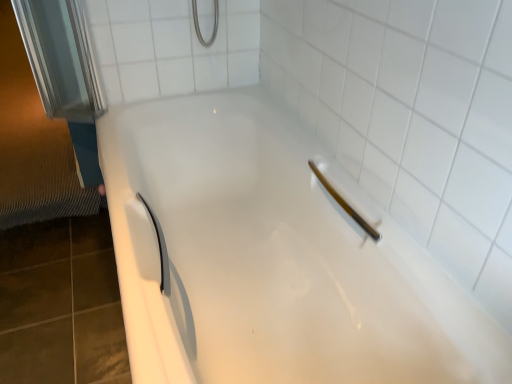
This screenshot has width=512, height=384. What do you see at coordinates (170, 47) in the screenshot?
I see `white ceramic tile at upper center` at bounding box center [170, 47].

Image resolution: width=512 pixels, height=384 pixels. I want to click on matte white shower at upper right, so click(345, 204).

The width and height of the screenshot is (512, 384). Find the location of `white ceramic tile at upper center`. white ceramic tile at upper center is located at coordinates (170, 47).

Who is taller, white ceramic tile at upper center or white glossy bathtub at center?

With more height is white ceramic tile at upper center.

Are white ceramic tile at upper center and white glossy bathtub at center far apart?

That's not correct — white ceramic tile at upper center is a little close to white glossy bathtub at center.

From a real-world perspective, is white ceramic tile at upper center above or below white glossy bathtub at center?

In terms of real-world spatial position, white ceramic tile at upper center is above white glossy bathtub at center.

Is white ceramic tile at upper center positioned with its back to white glossy bathtub at center?

No, white ceramic tile at upper center is not facing away from white glossy bathtub at center.

Looking at their sizes, would you say matte white shower at upper right is wider or thinner than white ceramic tile at upper center?

Clearly, matte white shower at upper right has more width compared to white ceramic tile at upper center.

From the image's perspective, is matte white shower at upper right above or below white ceramic tile at upper center?

Based on their image positions, matte white shower at upper right is located beneath white ceramic tile at upper center.

What's the angular difference between matte white shower at upper right and white ceramic tile at upper center's facing directions?

The angle between the facing direction of matte white shower at upper right and the facing direction of white ceramic tile at upper center is 90.3 degrees.

Is white ceramic tile at upper center surrounded by matte white shower at upper right?

Actually, white ceramic tile at upper center is outside matte white shower at upper right.

In order to click on ceramic tile that is behind the matte white shower at upper right in this screenshot , I will do `click(170, 47)`.

From a real-world perspective, is white ceramic tile at upper center positioned over matte white shower at upper right based on gravity?

Yes.

Can you tell me how much white ceramic tile at upper center and matte white shower at upper right differ in facing direction?

90.3 degrees separate the facing orientations of white ceramic tile at upper center and matte white shower at upper right.

Is white ceramic tile at upper center positioned with its back to matte white shower at upper right?

No, white ceramic tile at upper center's orientation is not away from matte white shower at upper right.

In terms of width, does matte white shower at upper right look wider or thinner when compared to white glossy bathtub at center?

In the image, matte white shower at upper right appears to be more narrow than white glossy bathtub at center.

Which is correct: matte white shower at upper right is inside white glossy bathtub at center, or outside of it?

The correct answer is: inside.

Who is smaller, matte white shower at upper right or white glossy bathtub at center?

With smaller size is matte white shower at upper right.

Is matte white shower at upper right not near white glossy bathtub at center?

No, matte white shower at upper right is in close proximity to white glossy bathtub at center.

Is white glossy bathtub at center touching matte white shower at upper right?

No, white glossy bathtub at center is not in contact with matte white shower at upper right.

Could you tell me if white glossy bathtub at center is facing matte white shower at upper right?

No, white glossy bathtub at center is not aimed at matte white shower at upper right.

You are a GUI agent. You are given a task and a screenshot of the screen. Output one action in this format:
    pyautogui.click(x=<x>, y=<y>)
    Task: Click on the shower lying behind the white glossy bathtub at center
    This screenshot has height=384, width=512.
    Given the screenshot: What is the action you would take?
    pyautogui.click(x=345, y=204)

From the picture: Is white glossy bathtub at center completely or partially outside of matte white shower at upper right?

Yes.

Considering the positions of point (275, 215) and point (147, 37), is point (275, 215) closer or farther from the camera than point (147, 37)?

Point (275, 215).

Considering the sizes of white glossy bathtub at center and white ceramic tile at upper center in the image, is white glossy bathtub at center wider or thinner than white ceramic tile at upper center?

In the image, white glossy bathtub at center appears to be wider than white ceramic tile at upper center.

From the image's perspective, who appears lower, white glossy bathtub at center or white ceramic tile at upper center?

white glossy bathtub at center.

Considering the relative sizes of white glossy bathtub at center and white ceramic tile at upper center in the image provided, is white glossy bathtub at center bigger than white ceramic tile at upper center?

Correct, white glossy bathtub at center is larger in size than white ceramic tile at upper center.

This screenshot has height=384, width=512. I want to click on bathtub below the white ceramic tile at upper center (from the image's perspective), so click(x=272, y=259).

Locate an element on the screen. The width and height of the screenshot is (512, 384). ceramic tile above the matte white shower at upper right (from the image's perspective) is located at coordinates (170, 47).

Looking at the image, which one is located closer to white ceramic tile at upper center, white glossy bathtub at center or matte white shower at upper right?

white glossy bathtub at center is positioned closer to the anchor white ceramic tile at upper center.

Based on their spatial positions, is white ceramic tile at upper center or white glossy bathtub at center closer to matte white shower at upper right?

Among the two, white glossy bathtub at center is located nearer to matte white shower at upper right.

Estimate the real-world distances between objects in this image. Which object is further from matte white shower at upper right, white glossy bathtub at center or white ceramic tile at upper center?

Among the two, white ceramic tile at upper center is located further to matte white shower at upper right.

From the image, which object appears to be farther from white glossy bathtub at center, white ceramic tile at upper center or matte white shower at upper right?

white ceramic tile at upper center is positioned further to the anchor white glossy bathtub at center.

When comparing their distances from white ceramic tile at upper center, does matte white shower at upper right or white glossy bathtub at center seem further?

matte white shower at upper right lies further to white ceramic tile at upper center than the other object.

Looking at the image, which one is located closer to white glossy bathtub at center, matte white shower at upper right or white ceramic tile at upper center?

matte white shower at upper right.

Find the location of `shower between white glossy bathtub at center and white ceramic tile at upper center in the front-back direction`. shower between white glossy bathtub at center and white ceramic tile at upper center in the front-back direction is located at coordinates (345, 204).